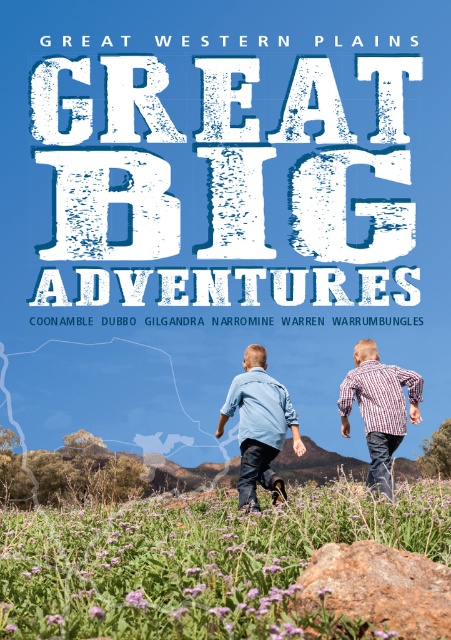
In the promotional poster for Great Western Plains, there are two children running away from you towards the silhouette of the plains. You notice a point marked at coordinates (197, 561). What object is located at that point?

The point at (197, 561) marks purple soft textured flowers at center.

You are a photographer trying to capture both the denim shirt at center and the striped cotton shirt at center in a single shot. Since you want to focus on the child closer to you, which child should you adjust your camera to focus on?

The denim shirt at center is further to the viewer than the striped cotton shirt at center, so you should focus on the denim shirt at center as it is closer.